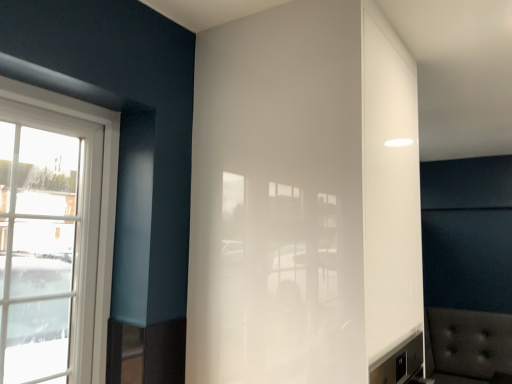
What do you see at coordinates (303, 197) in the screenshot? The height and width of the screenshot is (384, 512). I see `white glossy dresser at center` at bounding box center [303, 197].

This screenshot has height=384, width=512. Identify the location of white glossy dresser at center. pos(303,197).

Measure the distance between point [269,82] and camera.

A distance of 4.31 feet exists between point [269,82] and camera.

What is the approximate width of white glossy dresser at center?

The width of white glossy dresser at center is 24.86 inches.

At what (x,y) coordinates should I click in order to perform the action: click on white glossy dresser at center. Please return your answer as a coordinate pair (x, y). This screenshot has width=512, height=384. Looking at the image, I should click on (303, 197).